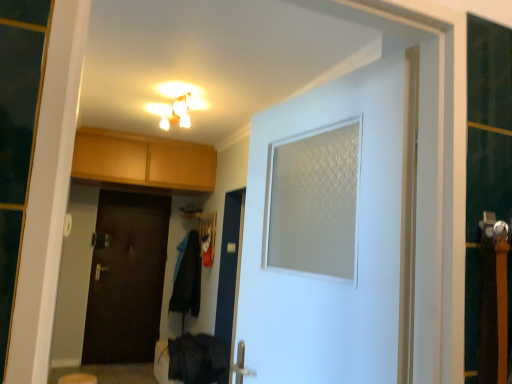
Question: Is black fabric coat at center, which is the 1th laundry in top-to-bottom order, located within white frosted glass door at center, which appears as the 2th door when viewed from the back?

Choices:
 (A) yes
 (B) no

Answer: (B)

Question: Can you confirm if white frosted glass door at center, which appears as the 2th door when viewed from the back, is taller than black fabric coat at center, which is the second laundry from bottom to top?

Choices:
 (A) yes
 (B) no

Answer: (B)

Question: Is white frosted glass door at center, which is the 2th door from left to right, bigger than black fabric coat at center, which is the 1th laundry in top-to-bottom order?

Choices:
 (A) no
 (B) yes

Answer: (A)

Question: Considering the relative positions of white frosted glass door at center, the 1th door when ordered from front to back, and black fabric coat at center, which is the second laundry from bottom to top, in the image provided, is white frosted glass door at center, the 1th door when ordered from front to back, behind black fabric coat at center, which is the second laundry from bottom to top,?

Choices:
 (A) yes
 (B) no

Answer: (B)

Question: Are white frosted glass door at center, which appears as the 2th door when viewed from the back, and black fabric coat at center, the 2th laundry positioned from the front, located far from each other?

Choices:
 (A) no
 (B) yes

Answer: (B)

Question: From a real-world perspective, is white frosted glass door at center, which is the first door in right-to-left order, physically below black fabric coat at center, which is the 1th laundry in top-to-bottom order?

Choices:
 (A) yes
 (B) no

Answer: (B)

Question: From the image's perspective, is black fabric coat at center, the 1th laundry positioned from the back, beneath matte white light fixture at upper center?

Choices:
 (A) no
 (B) yes

Answer: (B)

Question: Would you say matte white light fixture at upper center is part of black fabric coat at center, which is the 1th laundry in top-to-bottom order,'s contents?

Choices:
 (A) yes
 (B) no

Answer: (B)

Question: Does black fabric coat at center, which is the 1th laundry in top-to-bottom order, turn towards matte white light fixture at upper center?

Choices:
 (A) no
 (B) yes

Answer: (A)

Question: Is black fabric coat at center, the 1th laundry positioned from the back, turned away from matte white light fixture at upper center?

Choices:
 (A) no
 (B) yes

Answer: (A)

Question: Can you confirm if black fabric coat at center, which is the second laundry from bottom to top, is thinner than matte white light fixture at upper center?

Choices:
 (A) yes
 (B) no

Answer: (B)

Question: From a real-world perspective, is black fabric coat at center, the 2th laundry positioned from the front, physically below matte white light fixture at upper center?

Choices:
 (A) yes
 (B) no

Answer: (A)

Question: Does black fabric coat at center, which is the second laundry from bottom to top, appear on the left side of beige fabric step stool at lower left?

Choices:
 (A) yes
 (B) no

Answer: (B)